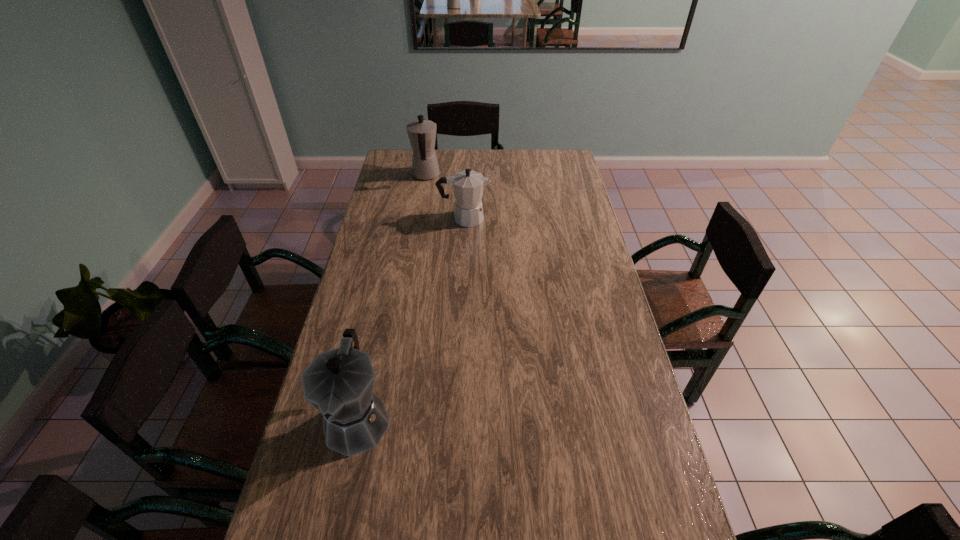
What are the coordinates of `the farthest object` in the screenshot? It's located at (422, 133).

I want to click on the nearest coffeepot, so click(339, 383).

The image size is (960, 540). Identify the location of the rightmost object. (468, 186).

Where is `the second farthest object`? Image resolution: width=960 pixels, height=540 pixels. the second farthest object is located at coordinates (468, 186).

The width and height of the screenshot is (960, 540). Identify the location of free space located 0.310m on the front of the farthest coffeepot. (417, 231).

Where is `vacant point located 0.160m at the spout of the nearest coffeepot`? vacant point located 0.160m at the spout of the nearest coffeepot is located at coordinates (331, 538).

You are a GUI agent. You are given a task and a screenshot of the screen. Output one action in this format:
    pyautogui.click(x=<x>, y=<y>)
    Task: Click on the vacant space positioned 0.060m at the spout of the second nearest object
    This screenshot has height=540, width=960.
    Given the screenshot: What is the action you would take?
    pyautogui.click(x=505, y=218)

Locate an element on the screen. This screenshot has width=960, height=540. object situated at the far edge is located at coordinates (422, 133).

You are a GUI agent. You are given a task and a screenshot of the screen. Output one action in this format:
    pyautogui.click(x=<x>, y=<y>)
    Task: Click on the object that is positioned at the far left corner
    
    Given the screenshot: What is the action you would take?
    pyautogui.click(x=422, y=133)

The width and height of the screenshot is (960, 540). Identify the location of vacant region at the left edge of the desktop. (376, 289).